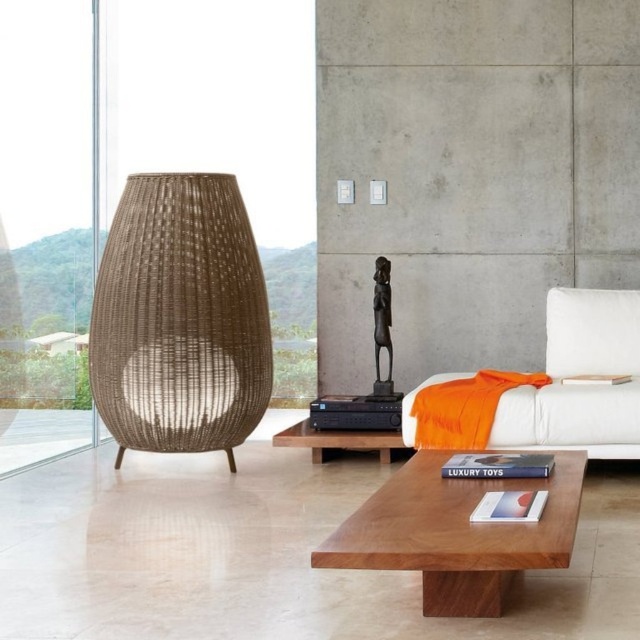
Question: Does transparent glass door at left have a smaller size compared to brown wooden table at center?

Choices:
 (A) yes
 (B) no

Answer: (B)

Question: Which point is closer to the camera taking this photo?

Choices:
 (A) (436, 579)
 (B) (621, 294)
 (C) (189, 212)

Answer: (A)

Question: Can you confirm if white fabric couch at right is wider than white fabric pillow at right?

Choices:
 (A) yes
 (B) no

Answer: (A)

Question: Can you confirm if woven beige lamp at left is positioned above brown wooden table at center?

Choices:
 (A) yes
 (B) no

Answer: (A)

Question: Estimate the real-world distances between objects in this image. Which object is closer to the brown wooden table at center?

Choices:
 (A) white fabric pillow at right
 (B) white fabric couch at right
 (C) woven beige lamp at left
 (D) transparent glass door at left

Answer: (B)

Question: Which object appears closest to the camera in this image?

Choices:
 (A) brown wooden table at center
 (B) transparent glass door at left
 (C) woven beige lamp at left

Answer: (A)